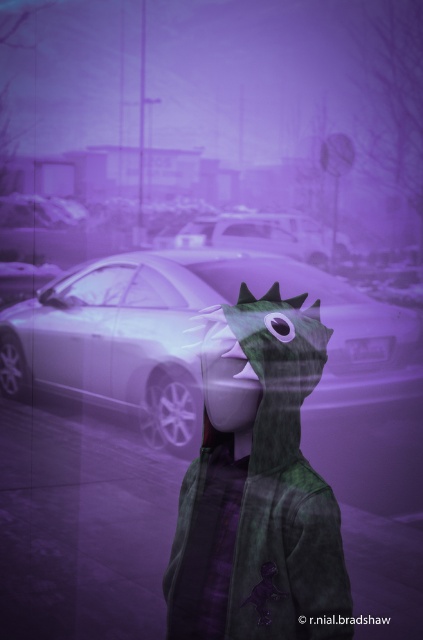
Question: Which point appears closest to the camera in this image?

Choices:
 (A) (332, 301)
 (B) (277, 627)

Answer: (B)

Question: Which object appears farthest from the camera in this image?

Choices:
 (A) shiny silver car at center
 (B) green matte dragon mask at center

Answer: (A)

Question: Does green matte dragon mask at center have a smaller size compared to shiny silver car at center?

Choices:
 (A) no
 (B) yes

Answer: (B)

Question: Does green matte dragon mask at center appear over shiny silver car at center?

Choices:
 (A) yes
 (B) no

Answer: (B)

Question: Does green matte dragon mask at center have a lesser width compared to shiny silver car at center?

Choices:
 (A) no
 (B) yes

Answer: (B)

Question: Among these objects, which one is nearest to the camera?

Choices:
 (A) shiny silver car at center
 (B) green matte dragon mask at center

Answer: (B)